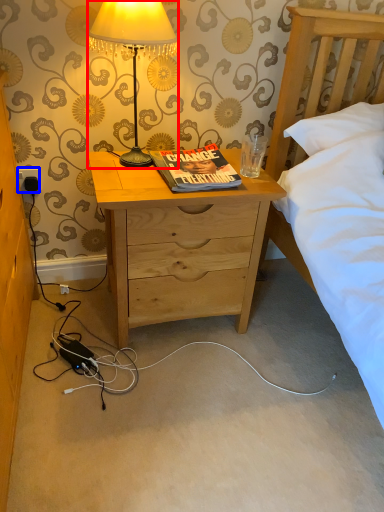
Question: Among these objects, which one is nearest to the camera, lamp (highlighted by a red box) or power outlet (highlighted by a blue box)?

Choices:
 (A) lamp
 (B) power outlet

Answer: (A)